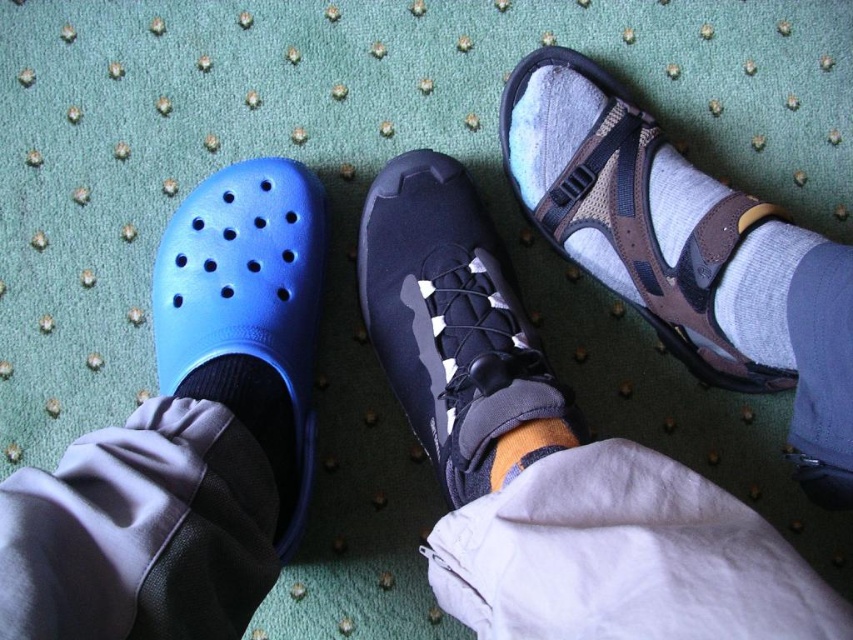
Question: Estimate the real-world distances between objects in this image. Which object is farther from the orange woolen sock at center?

Choices:
 (A) gray cotton sock at center
 (B) brown mesh sandal at upper right

Answer: (B)

Question: Observing the image, what is the correct spatial positioning of brown mesh sandal at upper right in reference to orange woolen sock at center?

Choices:
 (A) above
 (B) below

Answer: (A)

Question: Can you confirm if navy suede sneaker at center is thinner than blue rubber clog at left?

Choices:
 (A) yes
 (B) no

Answer: (B)

Question: Does navy suede sneaker at center have a lesser width compared to blue rubber clog at left?

Choices:
 (A) yes
 (B) no

Answer: (B)

Question: Which is nearer to the black knit sock at lower left?

Choices:
 (A) gray cotton sock at center
 (B) navy suede sneaker at center

Answer: (B)

Question: Which is nearer to the black knit sock at lower left?

Choices:
 (A) blue rubber clog at left
 (B) orange woolen sock at center
 (C) gray cotton sock at center

Answer: (A)